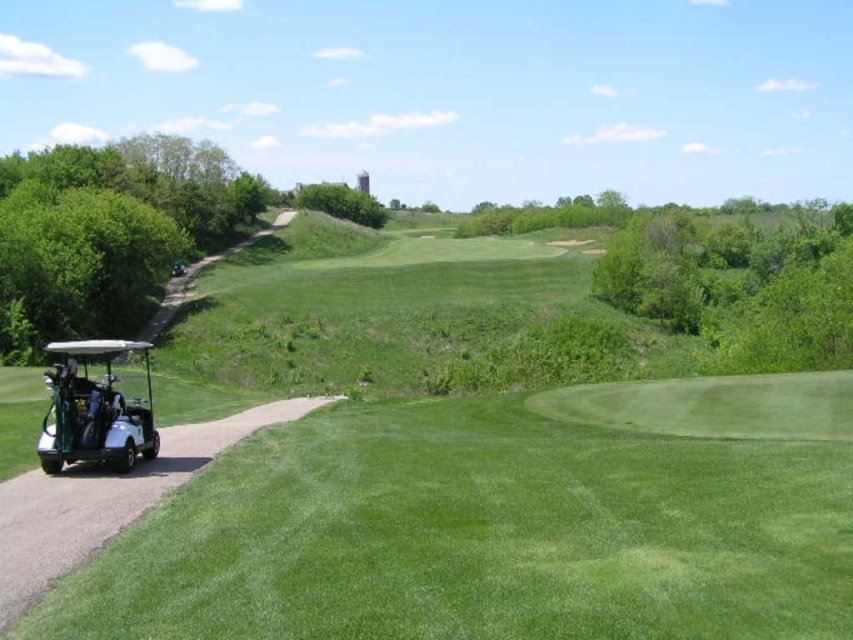
You are standing at the golf cart parked on the paved path and want to walk to the point marked at coordinates point (508, 332) and point (73, 364). Which point is closer to you?

Point (73, 364) is closer to you because it is nearer to the camera compared to point (508, 332), which is further away.

You are a groundskeeper planning to park two white matte golf carts. The scene shows a white matte golf cart at left and a white matte golf cart at lower left. Given their sizes, which parking spot would be more suitable for the larger cart if the spots are standard size?

The white matte golf cart at left is larger in width than the white matte golf cart at lower left, so the larger cart would require a wider parking spot. If the spots are standard size, the larger cart might not fit properly and may need a spot designated for larger vehicles.